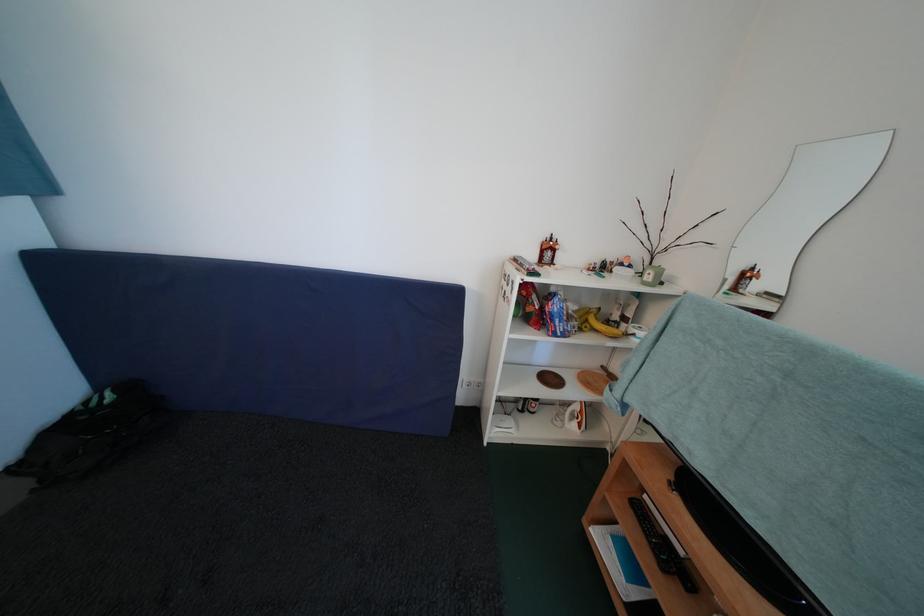
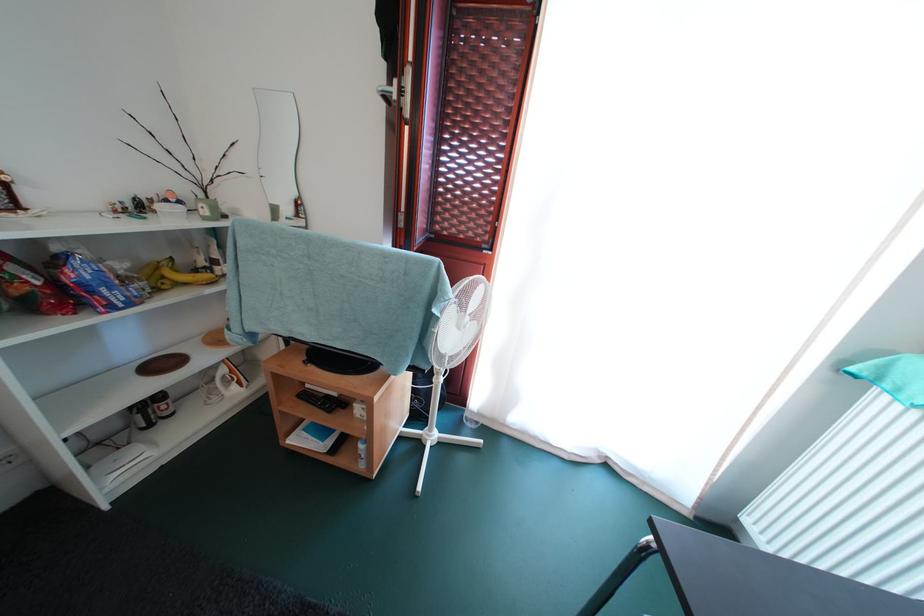
Locate, in the second image, the point that corresponds to (x=709, y=468) in the first image.

(318, 341)